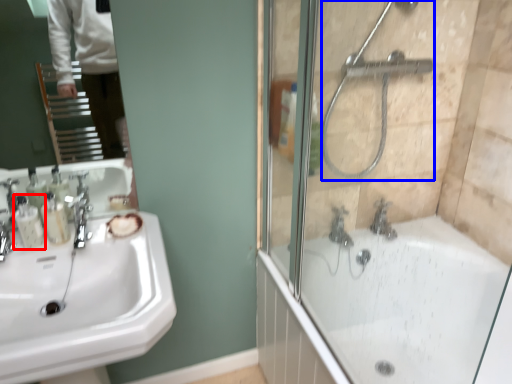
Question: Which point is closer to the camera, toiletry (highlighted by a red box) or shower (highlighted by a blue box)?

Choices:
 (A) toiletry
 (B) shower

Answer: (B)